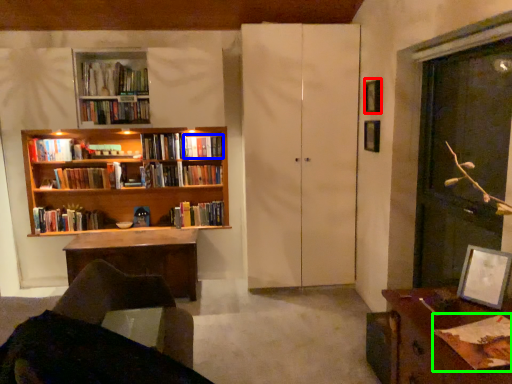
Question: Based on their relative distances, which object is farther from picture frame (highlighted by a red box)? Choose from book (highlighted by a blue box) and book (highlighted by a green box).

Choices:
 (A) book
 (B) book

Answer: (B)